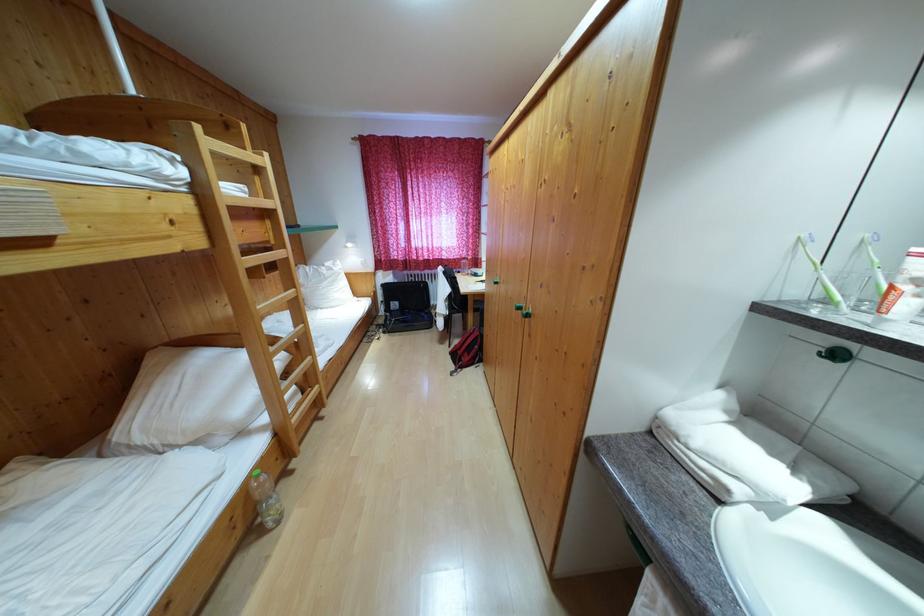
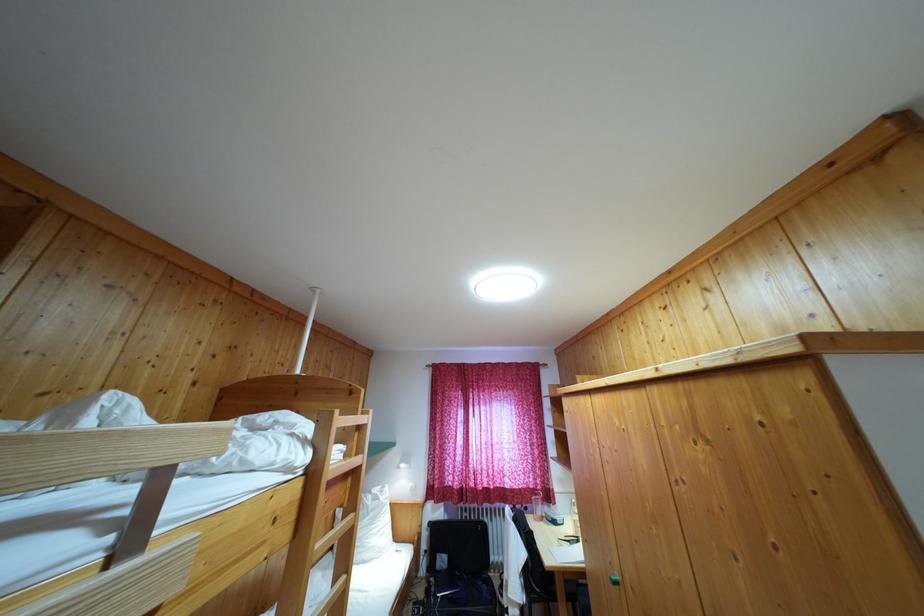
The point at (479, 309) is marked in the first image. Where is the corresponding point in the second image?

(569, 589)